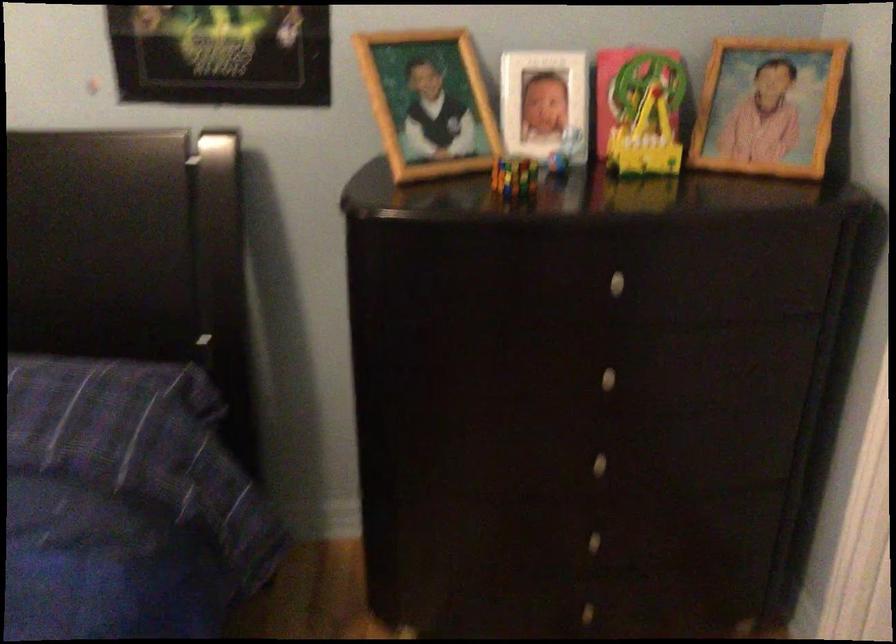
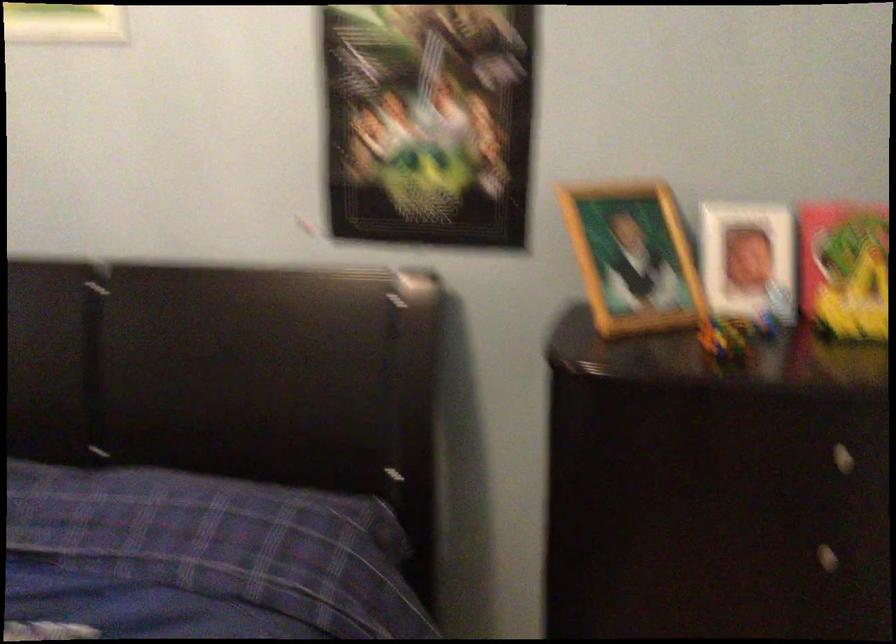
Locate, in the second image, the point that corresponds to point 597,381 in the first image.

(807, 554)